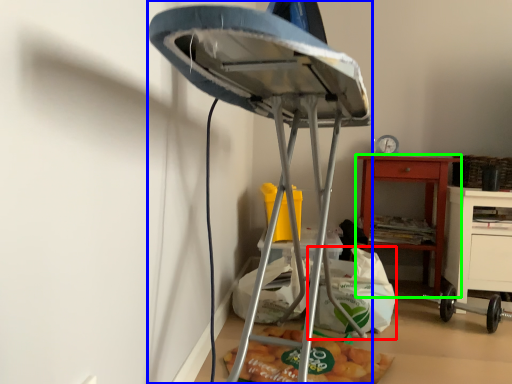
Question: Considering the real-world distances, which object is closest to shopping bag (highlighted by a red box)? furniture (highlighted by a blue box) or nightstand (highlighted by a green box).

Choices:
 (A) furniture
 (B) nightstand

Answer: (B)